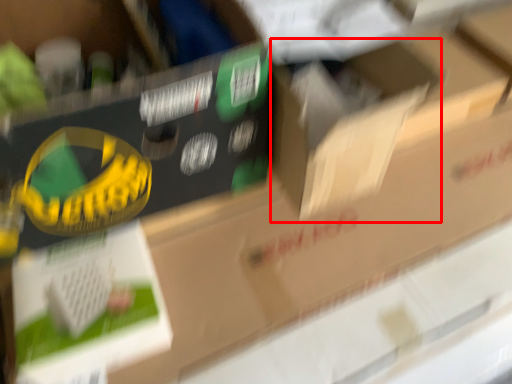
Question: Where is cardboard box (annotated by the red box) located in relation to storage box in the image?

Choices:
 (A) right
 (B) left

Answer: (A)